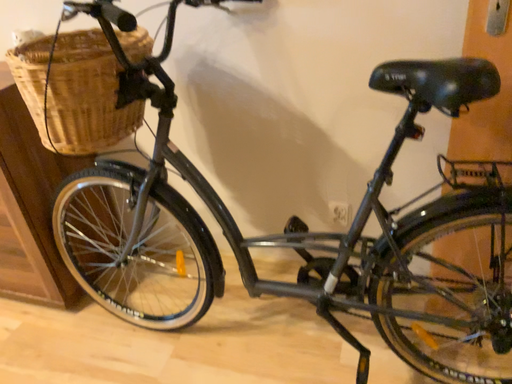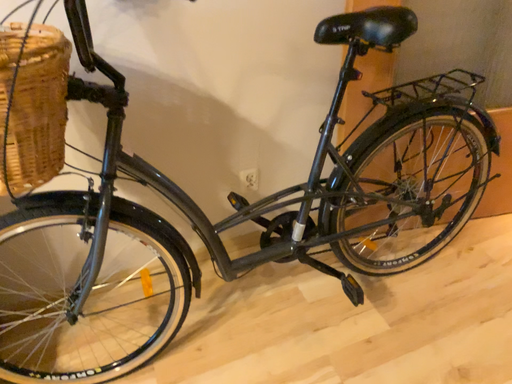
Question: Which way did the camera rotate in the video?

Choices:
 (A) rotated downward
 (B) rotated upward

Answer: (B)